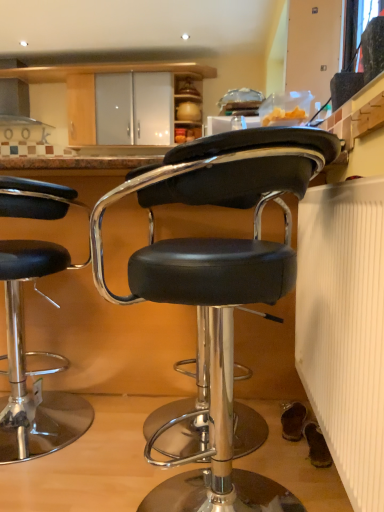
Question: Which direction should I rotate to look at black leather stool at center, placed as the 2th chair when sorted from back to front?

Choices:
 (A) left
 (B) right

Answer: (B)

Question: From a real-world perspective, is white ribbed radiator at lower right physically below black leather stool at center, the 1th chair from the front?

Choices:
 (A) no
 (B) yes

Answer: (A)

Question: Considering the relative sizes of white ribbed radiator at lower right and black leather stool at center, placed as the 1th chair when sorted from right to left, in the image provided, is white ribbed radiator at lower right smaller than black leather stool at center, placed as the 1th chair when sorted from right to left,?

Choices:
 (A) yes
 (B) no

Answer: (A)

Question: Is the position of white ribbed radiator at lower right more distant than that of black leather stool at center, the 1th chair from the front?

Choices:
 (A) yes
 (B) no

Answer: (B)

Question: Is white ribbed radiator at lower right turned away from black leather stool at center, placed as the 2th chair when sorted from back to front?

Choices:
 (A) yes
 (B) no

Answer: (A)

Question: Does white ribbed radiator at lower right have a greater height compared to black leather stool at center, placed as the 2th chair when sorted from back to front?

Choices:
 (A) no
 (B) yes

Answer: (A)

Question: Would you say white ribbed radiator at lower right is a long distance from black leather stool at center, the second chair positioned from the left?

Choices:
 (A) no
 (B) yes

Answer: (A)

Question: Is black leather stool at center, the second chair positioned from the left, wider than black leather stool at left, which ranks as the 2th chair in front-to-back order?

Choices:
 (A) yes
 (B) no

Answer: (B)

Question: From the image's perspective, does black leather stool at center, the second chair positioned from the left, appear lower than black leather stool at left, which appears as the 1th chair when viewed from the back?

Choices:
 (A) no
 (B) yes

Answer: (B)

Question: Does black leather stool at center, placed as the 1th chair when sorted from right to left, have a lesser height compared to black leather stool at left, which appears as the 1th chair when viewed from the back?

Choices:
 (A) yes
 (B) no

Answer: (B)

Question: Is black leather stool at center, placed as the 1th chair when sorted from right to left, far away from black leather stool at left, which appears as the 1th chair when viewed from the back?

Choices:
 (A) no
 (B) yes

Answer: (A)

Question: Can you confirm if black leather stool at center, the second chair positioned from the left, is bigger than black leather stool at left, which ranks as the 2th chair in front-to-back order?

Choices:
 (A) no
 (B) yes

Answer: (B)

Question: Is black leather stool at center, the second chair positioned from the left, smaller than black leather stool at left, which appears as the 1th chair when viewed from the back?

Choices:
 (A) no
 (B) yes

Answer: (A)

Question: Would you say transparent glass window screen at upper right contains black leather stool at center, placed as the 1th chair when sorted from right to left?

Choices:
 (A) yes
 (B) no

Answer: (B)